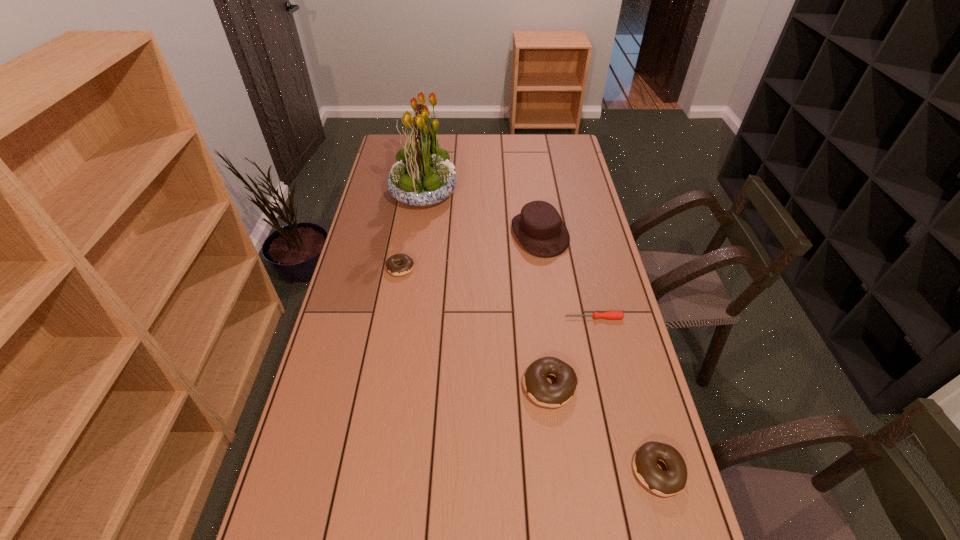
This screenshot has height=540, width=960. I want to click on spot to insert another doughnut for uniform distribution, so click(467, 320).